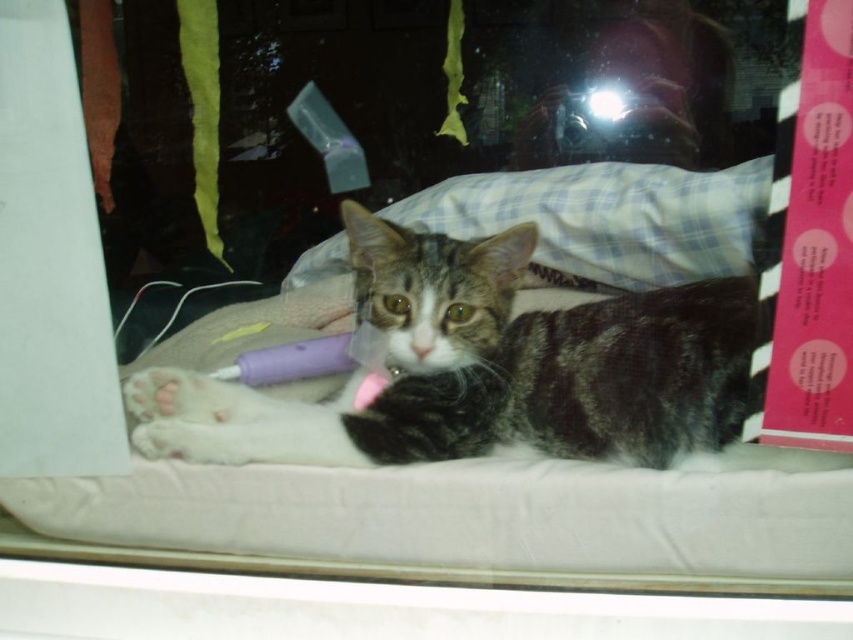
Question: Does tabby fur cat at center have a greater width compared to plaid fabric pillow at center?

Choices:
 (A) yes
 (B) no

Answer: (B)

Question: Which point is farther to the camera?

Choices:
 (A) plaid fabric pillow at center
 (B) tabby fur cat at center

Answer: (A)

Question: Is tabby fur cat at center to the left of plaid fabric pillow at center from the viewer's perspective?

Choices:
 (A) yes
 (B) no

Answer: (A)

Question: Can you confirm if tabby fur cat at center is positioned above plaid fabric pillow at center?

Choices:
 (A) no
 (B) yes

Answer: (A)